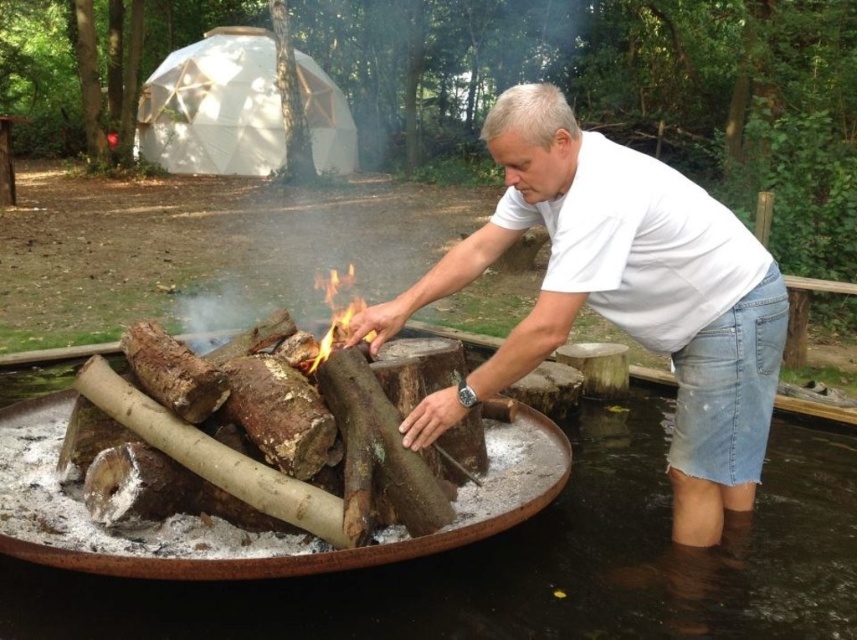
You are standing at the edge of the water where the fire pit is placed. You need to move the white cotton shirt at center to the geodesic dome tent in the background. Which direction should you move it relative to the charred wood fire at center?

The white cotton shirt at center is to the right of the charred wood fire at center, so you should move it towards the right direction relative to the fire to reach the geodesic dome tent in the background.

You are standing at the point labeled point (330, 353) and want to move towards the geodesic dome structure. Which direction should you walk relative to the point labeled point (567, 252)?

You should walk towards the point labeled point (567, 252) because it is in front of point (330, 353), meaning it is closer to the geodesic dome structure.